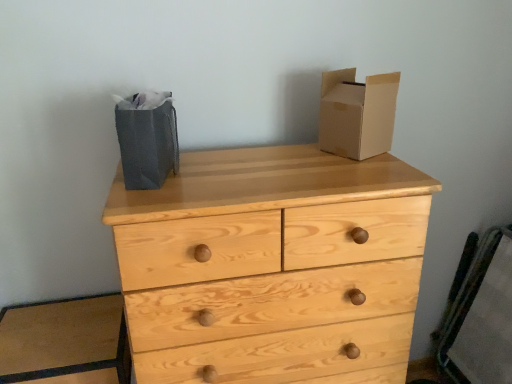
Locate an element on the screen. The image size is (512, 384). vacant area that lies to the right of gray paper bag at left is located at coordinates (208, 168).